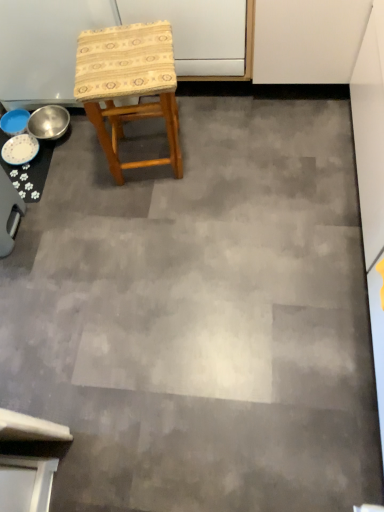
Where is `blank space above woven fabric stool at center (from a real-world perspective)`? blank space above woven fabric stool at center (from a real-world perspective) is located at coordinates (122, 56).